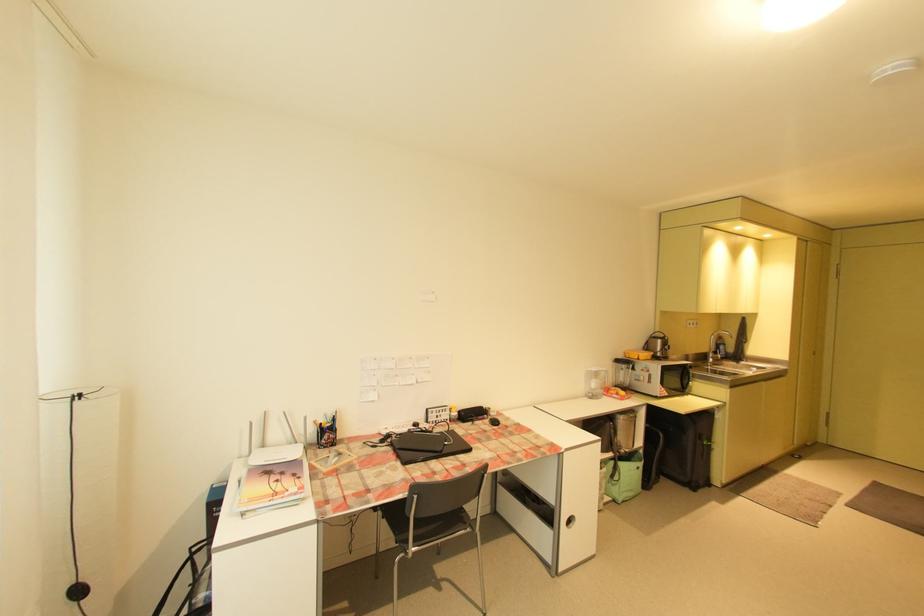
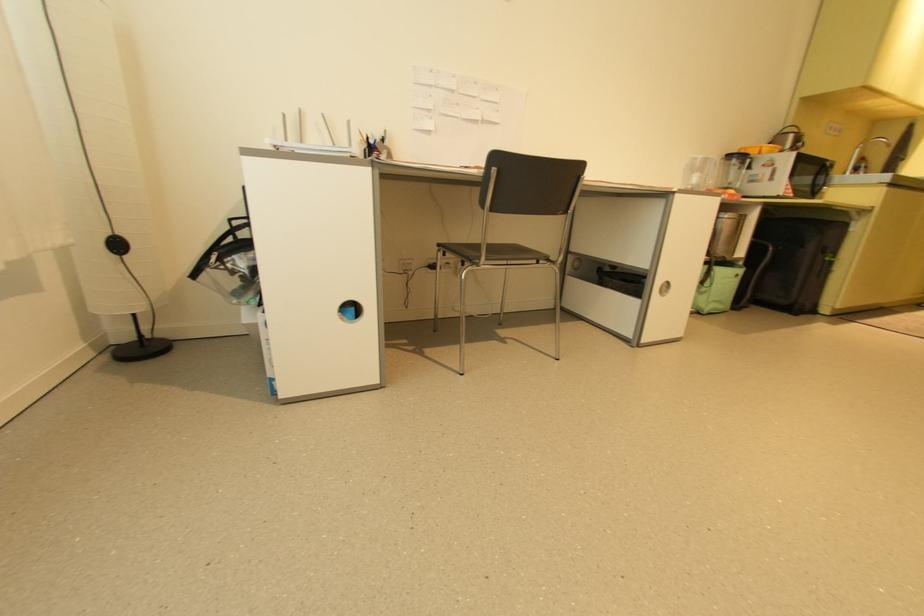
Question: The images are taken continuously from a first-person perspective. In which direction is your viewpoint rotating?

Choices:
 (A) Left
 (B) Right
 (C) Up
 (D) Down

Answer: (D)